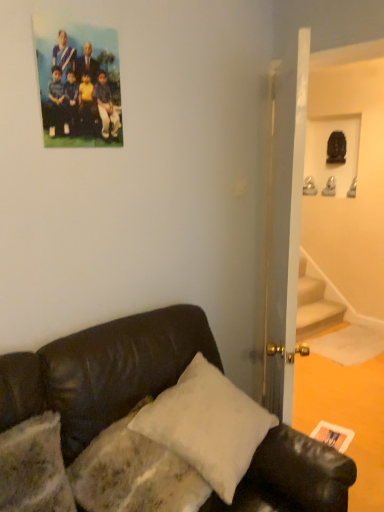
Question: Can you confirm if matte plastic photo at upper left is shorter than white matte postcard at lower right?

Choices:
 (A) no
 (B) yes

Answer: (A)

Question: Is matte plastic photo at upper left oriented away from white matte postcard at lower right?

Choices:
 (A) no
 (B) yes

Answer: (A)

Question: Is matte plastic photo at upper left wider than white matte postcard at lower right?

Choices:
 (A) no
 (B) yes

Answer: (A)

Question: Is matte plastic photo at upper left to the right of white matte postcard at lower right from the viewer's perspective?

Choices:
 (A) yes
 (B) no

Answer: (B)

Question: From a real-world perspective, is matte plastic photo at upper left on white matte postcard at lower right?

Choices:
 (A) yes
 (B) no

Answer: (A)

Question: From a real-world perspective, is white matte postcard at lower right physically located above or below matte plastic photo at upper left?

Choices:
 (A) below
 (B) above

Answer: (A)

Question: Considering the positions of white matte postcard at lower right and matte plastic photo at upper left in the image, is white matte postcard at lower right taller or shorter than matte plastic photo at upper left?

Choices:
 (A) short
 (B) tall

Answer: (A)

Question: Considering the positions of point (347, 445) and point (104, 29), is point (347, 445) closer or farther from the camera than point (104, 29)?

Choices:
 (A) farther
 (B) closer

Answer: (A)

Question: Visually, is white matte postcard at lower right positioned to the left or to the right of matte plastic photo at upper left?

Choices:
 (A) right
 (B) left

Answer: (A)

Question: Considering the positions of white matte postcard at lower right and white soft pillow at lower center in the image, is white matte postcard at lower right taller or shorter than white soft pillow at lower center?

Choices:
 (A) tall
 (B) short

Answer: (B)

Question: From the image's perspective, is white matte postcard at lower right above or below white soft pillow at lower center?

Choices:
 (A) above
 (B) below

Answer: (B)

Question: Is point (349, 440) positioned closer to the camera than point (134, 442)?

Choices:
 (A) closer
 (B) farther

Answer: (B)

Question: In terms of size, does white matte postcard at lower right appear bigger or smaller than white soft pillow at lower center?

Choices:
 (A) small
 (B) big

Answer: (A)

Question: Considering their positions, is black leather couch at lower left located in front of or behind white matte postcard at lower right?

Choices:
 (A) behind
 (B) front

Answer: (B)

Question: Considering the positions of black leather couch at lower left and white matte postcard at lower right in the image, is black leather couch at lower left wider or thinner than white matte postcard at lower right?

Choices:
 (A) thin
 (B) wide

Answer: (B)